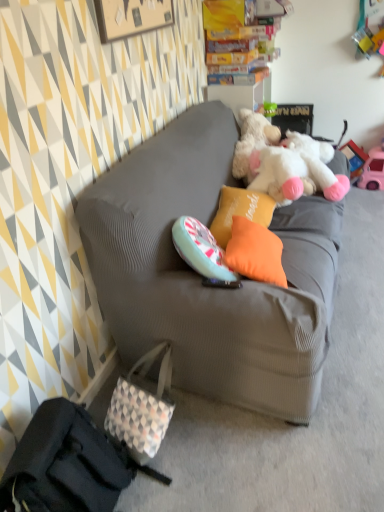
The height and width of the screenshot is (512, 384). I want to click on empty space that is in between gray fabric couch at center and white checkered fabric handbag at lower left, the 2th handbag viewed from the front, so click(x=208, y=445).